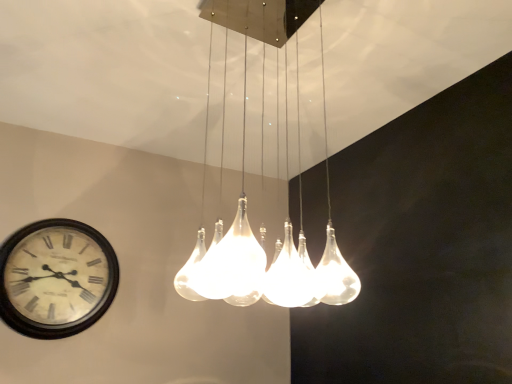
Question: Which is correct: white glossy clock at lower left is inside translucent glass chandelier at center, or outside of it?

Choices:
 (A) inside
 (B) outside

Answer: (B)

Question: From the image's perspective, is white glossy clock at lower left above or below translucent glass chandelier at center?

Choices:
 (A) above
 (B) below

Answer: (B)

Question: From a real-world perspective, is white glossy clock at lower left physically located above or below translucent glass chandelier at center?

Choices:
 (A) above
 (B) below

Answer: (B)

Question: Considering the positions of translucent glass chandelier at center and white glossy clock at lower left in the image, is translucent glass chandelier at center bigger or smaller than white glossy clock at lower left?

Choices:
 (A) big
 (B) small

Answer: (A)

Question: In the image, is translucent glass chandelier at center on the left side or the right side of white glossy clock at lower left?

Choices:
 (A) right
 (B) left

Answer: (A)

Question: From a real-world perspective, is translucent glass chandelier at center positioned above or below white glossy clock at lower left?

Choices:
 (A) above
 (B) below

Answer: (A)

Question: In terms of height, does translucent glass chandelier at center look taller or shorter compared to white glossy clock at lower left?

Choices:
 (A) short
 (B) tall

Answer: (B)